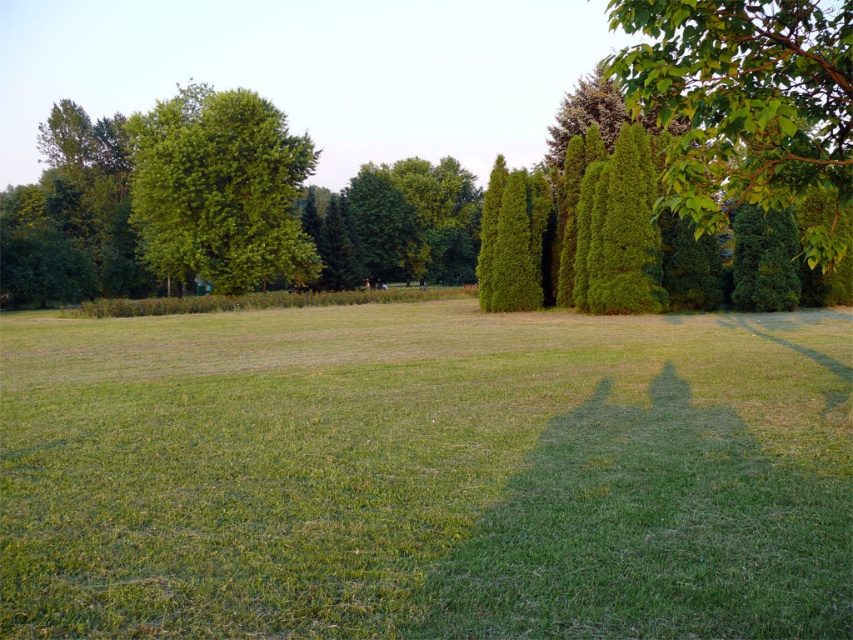
Question: Which point is closer to the camera?

Choices:
 (A) (320, 385)
 (B) (283, 164)
 (C) (798, 156)

Answer: (C)

Question: Which of these objects is positioned closest to the green grass at center?

Choices:
 (A) green leafy tree at upper left
 (B) green leafy tree at upper right

Answer: (B)

Question: Which object is positioned farthest from the green leafy tree at upper left?

Choices:
 (A) green grass at center
 (B) green leafy tree at upper right

Answer: (A)

Question: Is green grass at center wider than green leafy tree at upper left?

Choices:
 (A) yes
 (B) no

Answer: (A)

Question: Is green grass at center in front of green leafy tree at upper right?

Choices:
 (A) no
 (B) yes

Answer: (B)

Question: Can you confirm if green leafy tree at upper right is positioned to the left of green leafy tree at upper left?

Choices:
 (A) yes
 (B) no

Answer: (B)